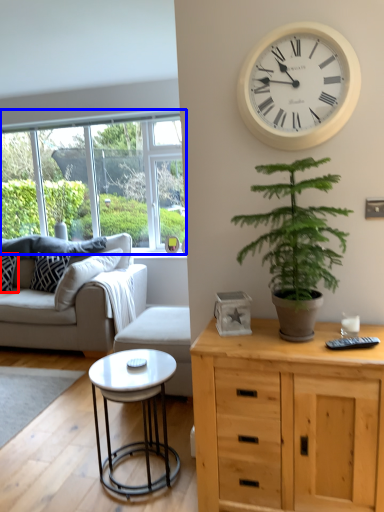
Question: Which object appears farthest to the camera in this image, pillow (highlighted by a red box) or window (highlighted by a blue box)?

Choices:
 (A) pillow
 (B) window

Answer: (B)